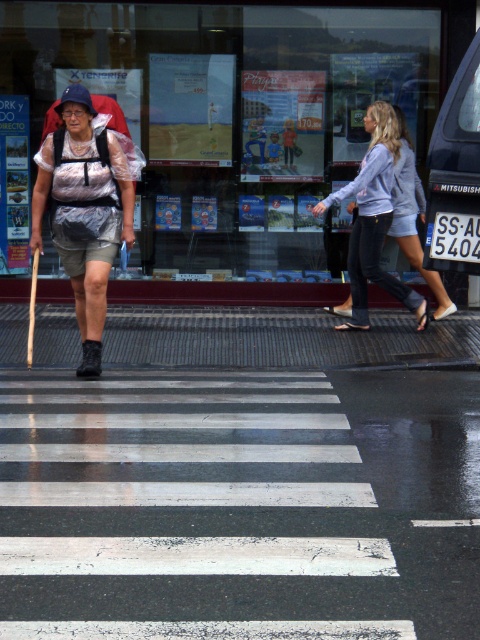
You are standing at the point marked by coordinates point (84, 209). Looking around, you see a matte plastic bag at center. Which direction should you move to reach the nearest zebra crossing?

The point (84, 209) corresponds to the matte plastic bag at center. Since the scene shows pedestrians crossing a zebra crossing, the nearest zebra crossing is likely in front of the woman walking towards the camera. Therefore, you should move forward from the matte plastic bag at center to reach the zebra crossing.

You are a delivery person who needs to place a small package on the ground near the matte plastic bag at center and denim shorts at center. Which object should you place the package closer to so that it is visible from above without being blocked by the other object?

The matte plastic bag at center is much taller than denim shorts at center. To ensure visibility from above, place the package closer to the denim shorts at center since the taller matte plastic bag at center could block the view.

You are a delivery person trying to decide which item to place in a narrow compartment. You see a matte plastic bag at center and a denim shorts at center. Which item is thinner and can fit better in the narrow space?

The matte plastic bag at center is thinner than the denim shorts at center, so it can fit better in the narrow compartment.